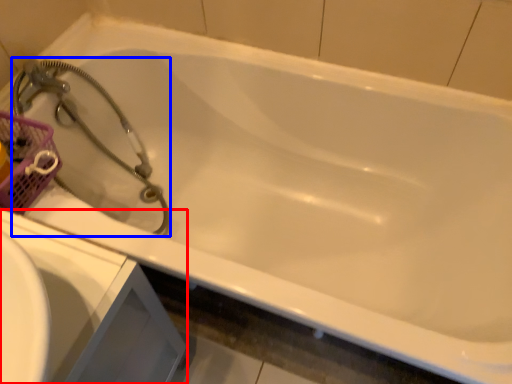
Question: Which of the following is the farthest to the observer, sink (highlighted by a red box) or garden hose (highlighted by a blue box)?

Choices:
 (A) sink
 (B) garden hose

Answer: (B)